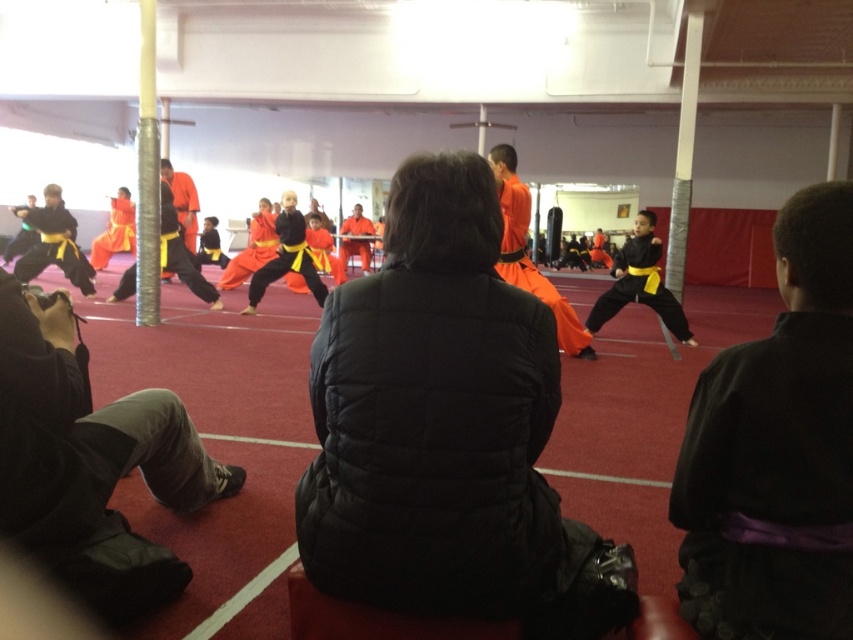
Consider the image. You are a photographer standing at the back of the room. You need to capture a clear photo of both the matte black martial arts uniform at center and the orange fabric pants at center. Which object should you focus on first to ensure both are in focus?

Since the matte black martial arts uniform at center is shorter than the orange fabric pants at center, you should focus on the orange fabric pants at center first to ensure both are in focus.

You are a photographer at the martial arts training session. You need to capture a closeup shot of the black quilted jacket at center and orange fabric pants at center. Which object will require a wider angle lens to capture fully in the frame?

The orange fabric pants at center requires a wider angle lens because its width is greater than the black quilted jacket at center.

You are standing at the point labeled point (44, 224) and want to move to the point labeled point (680, 312). Can you walk directly towards it without moving past it?

Yes, because point (680, 312) is in front of point (44, 224), so you can walk directly towards it without moving past it.